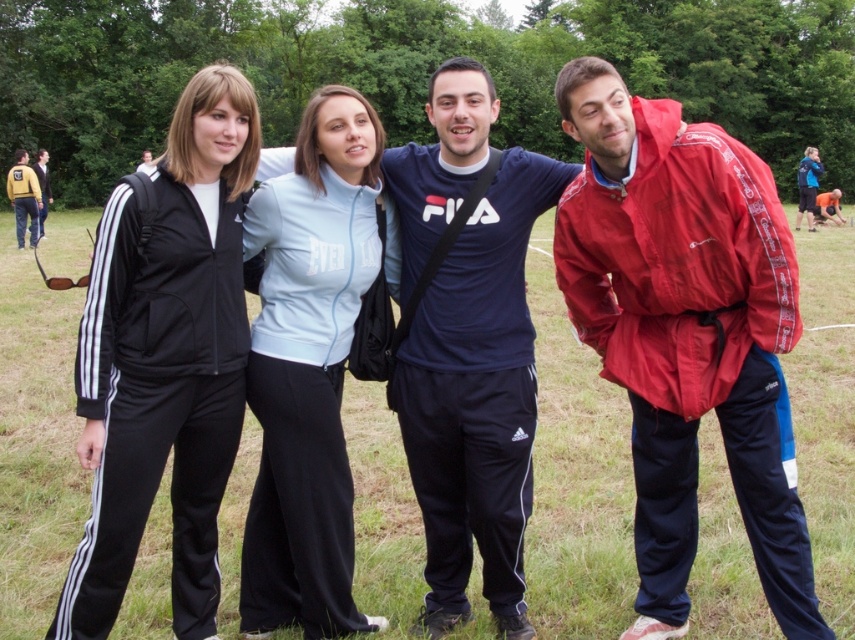
Is black track suit at left shorter than yellow leather jacket at left?

Yes.

In order to click on black track suit at left in this screenshot , I will do `click(166, 358)`.

Locate an element on the screen. Image resolution: width=855 pixels, height=640 pixels. black track suit at left is located at coordinates (166, 358).

Who is more distant from viewer, (44, 234) or (834, 209)?

The point (834, 209) is more distant.

Image resolution: width=855 pixels, height=640 pixels. Identify the location of yellow leather jacket at left. (42, 186).

You are a GUI agent. You are given a task and a screenshot of the screen. Output one action in this format:
    pyautogui.click(x=<x>, y=<y>)
    Task: Click on the yellow leather jacket at left
    
    Given the screenshot: What is the action you would take?
    pyautogui.click(x=42, y=186)

Between black matte tracksuit at center and blue fabric jacket at upper right, which one has less height?

black matte tracksuit at center

Between point (557, 419) and point (817, 172), which one is positioned in front?

Point (557, 419) is in front.

The image size is (855, 640). In order to click on black matte tracksuit at center in this screenshot , I will do `click(576, 476)`.